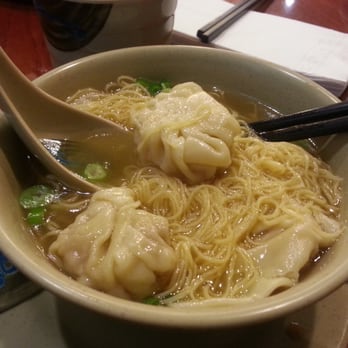
You are a GUI agent. You are given a task and a screenshot of the screen. Output one action in this format:
    pyautogui.click(x=<x>, y=<y>)
    Task: Click on the chopstick
    
    Given the screenshot: What is the action you would take?
    pyautogui.click(x=300, y=121)